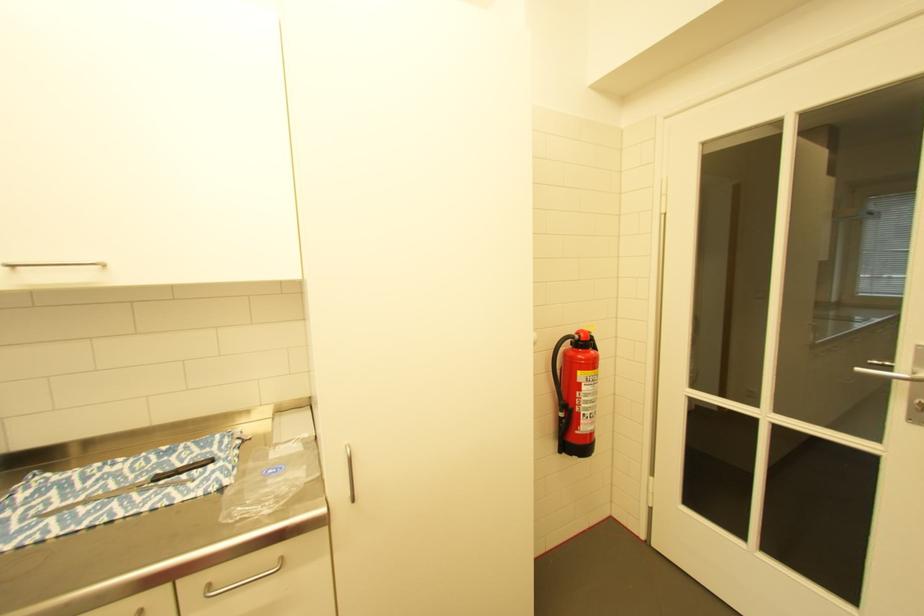
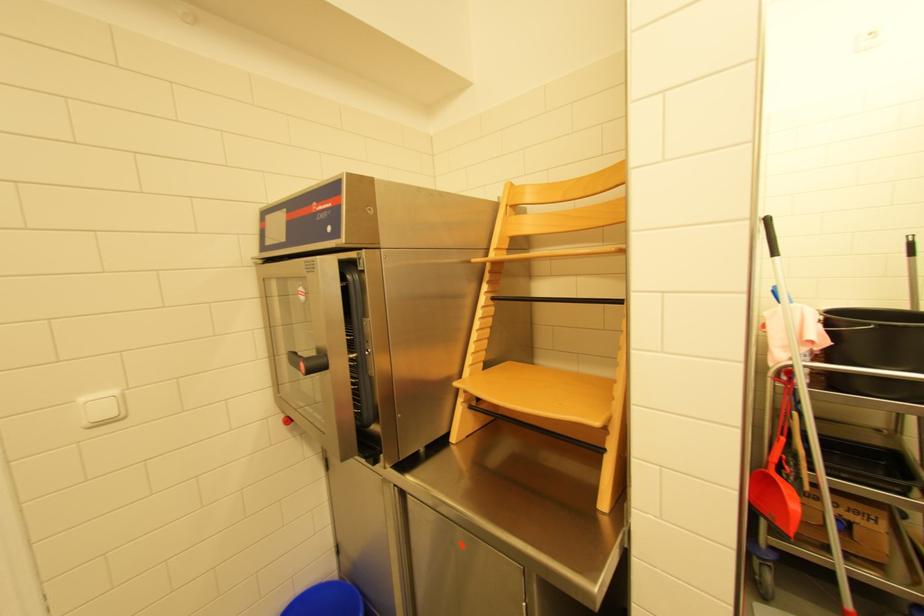
Question: The first image is from the beginning of the video and the second image is from the end. How did the camera likely rotate when shooting the video?

Choices:
 (A) Left
 (B) Right
 (C) Up
 (D) Down

Answer: (B)